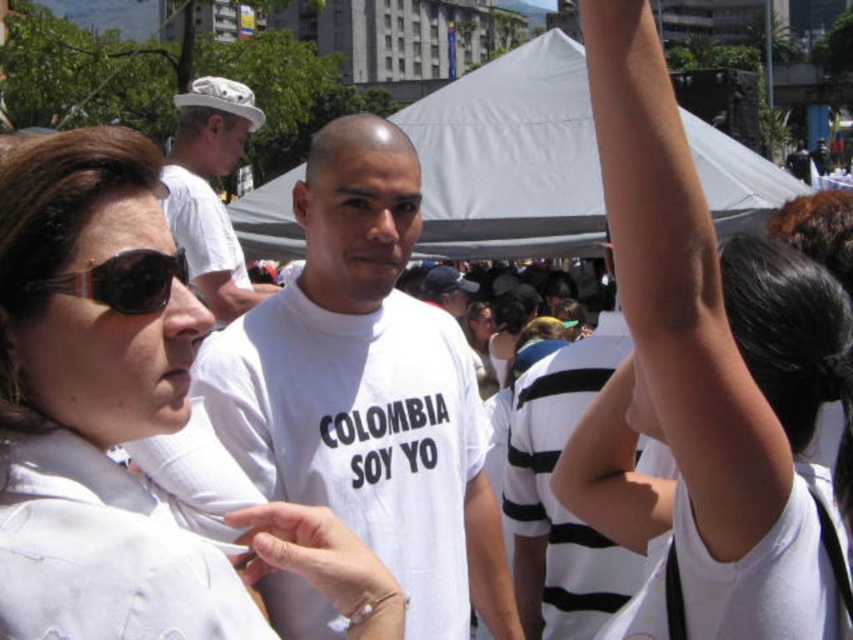
You are a photographer taking a picture of the white matte shirt at center and the white matte arm at upper right. Which object is positioned higher in the frame?

The white matte arm at upper right is positioned higher in the frame than the white matte shirt at center.

You are a photographer standing at the center of the scene. You want to take a photo of the white matte shirt at center and the white matte arm at upper right. Given that your camera has a maximum focus range of 60 feet, will both objects be in focus?

The white matte arm at upper right is 61.62 feet from the white matte shirt at center. Since the camera can only focus up to 60 feet, the distance between them exceeds the focus range. Therefore, both objects cannot be in focus simultaneously.